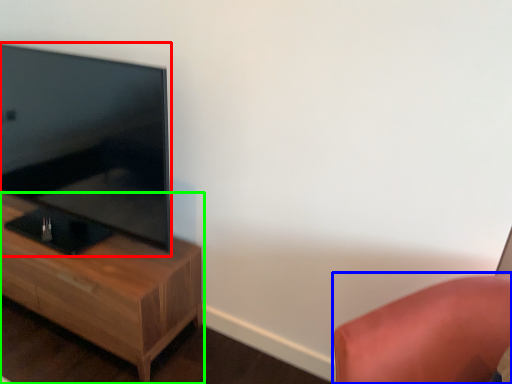
Question: Which is nearer to the television (highlighted by a red box)? furniture (highlighted by a blue box) or nightstand (highlighted by a green box).

Choices:
 (A) furniture
 (B) nightstand

Answer: (B)